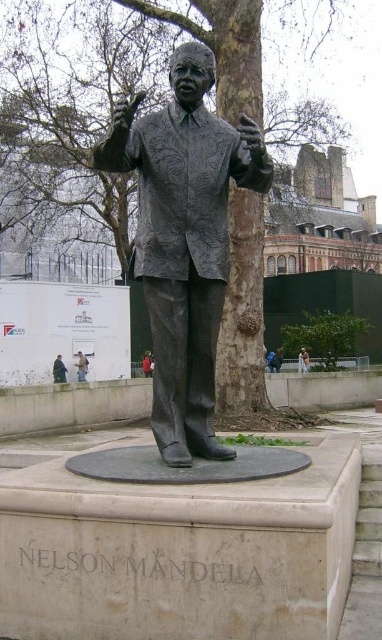
Can you confirm if bronze statue at center is taller than green leafy tree at center?

No.

Is bronze statue at center wider than green leafy tree at center?

In fact, bronze statue at center might be narrower than green leafy tree at center.

Describe the element at coordinates (184, 241) in the screenshot. I see `bronze statue at center` at that location.

The image size is (382, 640). Find the location of `bronze statue at center`. bronze statue at center is located at coordinates (184, 241).

How far apart are bronze statue at center and brown textured tree at center?

bronze statue at center and brown textured tree at center are 20.57 meters apart from each other.

This screenshot has width=382, height=640. What do you see at coordinates (184, 241) in the screenshot? I see `bronze statue at center` at bounding box center [184, 241].

Image resolution: width=382 pixels, height=640 pixels. I want to click on bronze statue at center, so click(184, 241).

From the picture: Is brown textured tree at center positioned before green leafy tree at center?

Yes.

Between brown textured tree at center and green leafy tree at center, which one has more height?

Standing taller between the two is brown textured tree at center.

You are a GUI agent. You are given a task and a screenshot of the screen. Output one action in this format:
    pyautogui.click(x=<x>, y=<y>)
    Task: Click on the brown textured tree at center
    This screenshot has height=640, width=382.
    Given the screenshot: What is the action you would take?
    pyautogui.click(x=242, y=310)

This screenshot has width=382, height=640. What are the coordinates of `brown textured tree at center` in the screenshot? It's located at (242, 310).